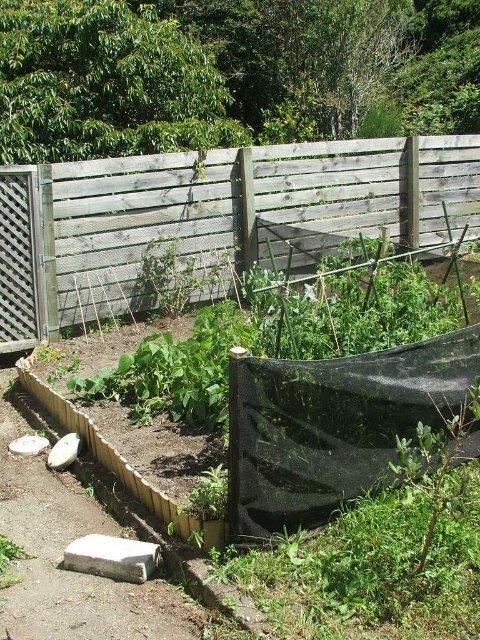
You are standing in the garden looking at the fence and the raised garden bed. There are two points marked in the image. Can you determine which point is closer to you, point A at coordinates point A is point (104, 220) and point B is point (47, 477)?

Point B at coordinates point (47, 477) is closer to you because the description states that point A is behind point B.

You are a gardener standing on the brown dirt path at lower left and want to reach the wooden fence at upper center. Can you walk directly to it without stepping off the path?

The wooden fence at upper center is positioned over the brown dirt path at lower left, meaning the path leads directly to the fence. Therefore, you can walk straight along the brown dirt path at lower left to reach the wooden fence at upper center without needing to step off the path.

You are a gardener planning to install a new sprinkler system. You need to determine which area is more suitable for placing the sprinkler head so that it can cover both the wooden fence at upper center and the brown dirt path at lower left. Based on their sizes, which location would allow the sprinkler to effectively cover both areas?

The wooden fence at upper center is smaller than the brown dirt path at lower left. To cover both areas effectively, the sprinkler head should be placed closer to the smaller wooden fence at upper center, ensuring it can reach the larger brown dirt path at lower left with its spray range.